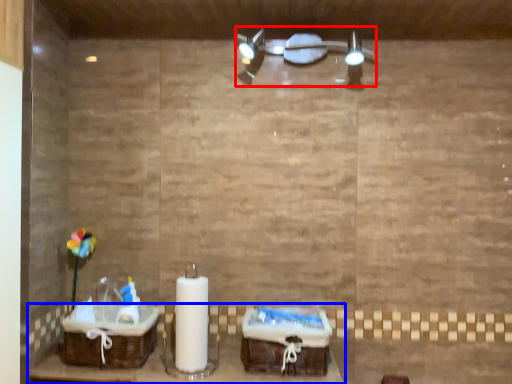
Question: Which object appears farthest to the camera in this image, light fixture (highlighted by a red box) or furniture (highlighted by a blue box)?

Choices:
 (A) light fixture
 (B) furniture

Answer: (A)